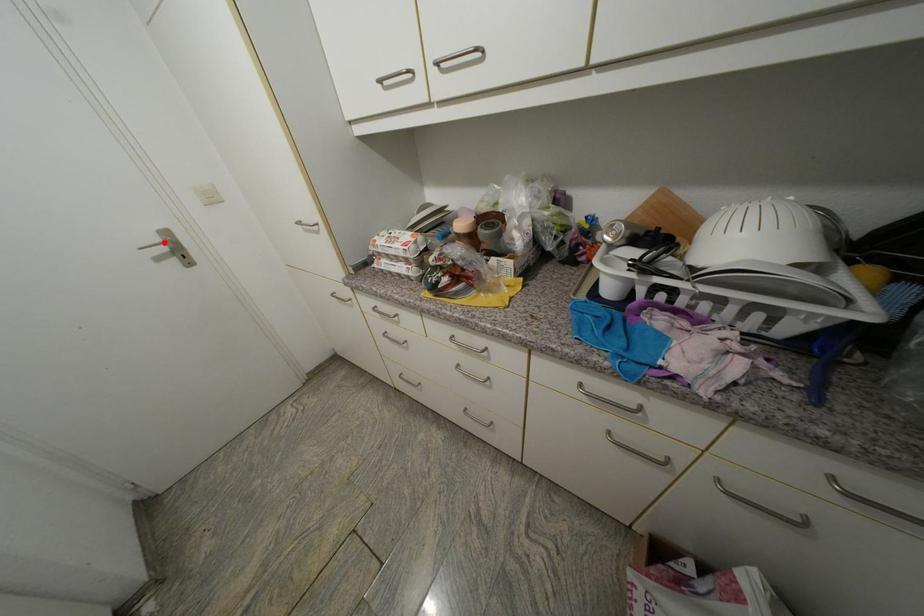
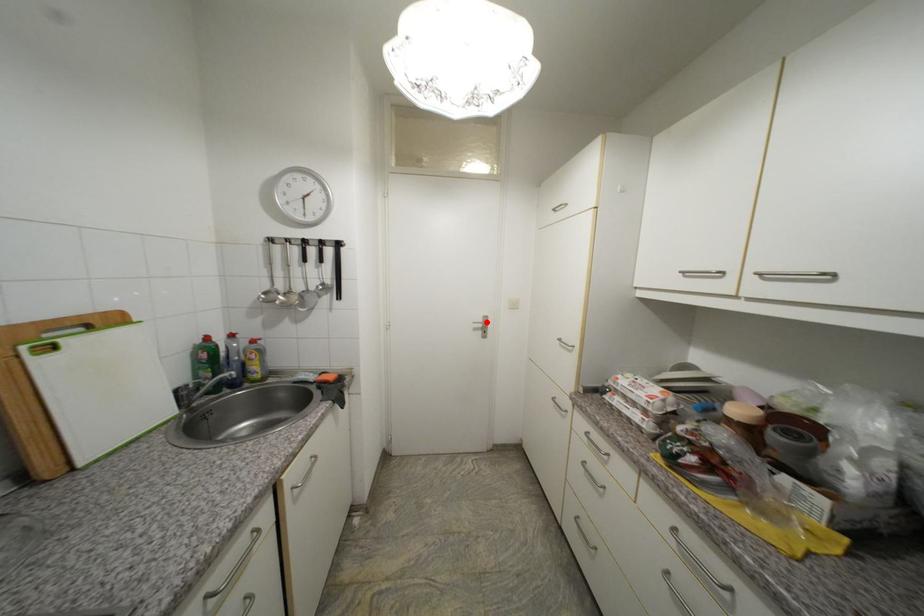
I am providing you with two images of the same scene from different viewpoints. A red point is marked on the first image and another point is marked on the second image. Do the highlighted points in image1 and image2 indicate the same real-world spot?

Yes